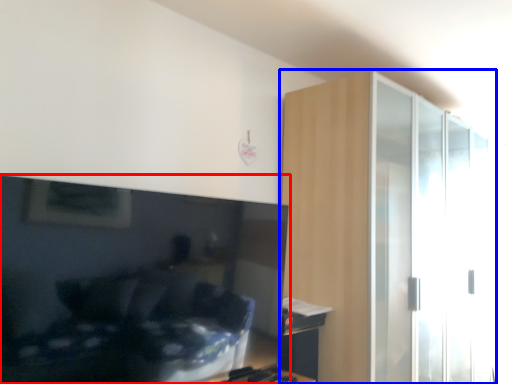
Question: Among these objects, which one is nearest to the camera, television (highlighted by a red box) or dresser (highlighted by a blue box)?

Choices:
 (A) television
 (B) dresser

Answer: (A)